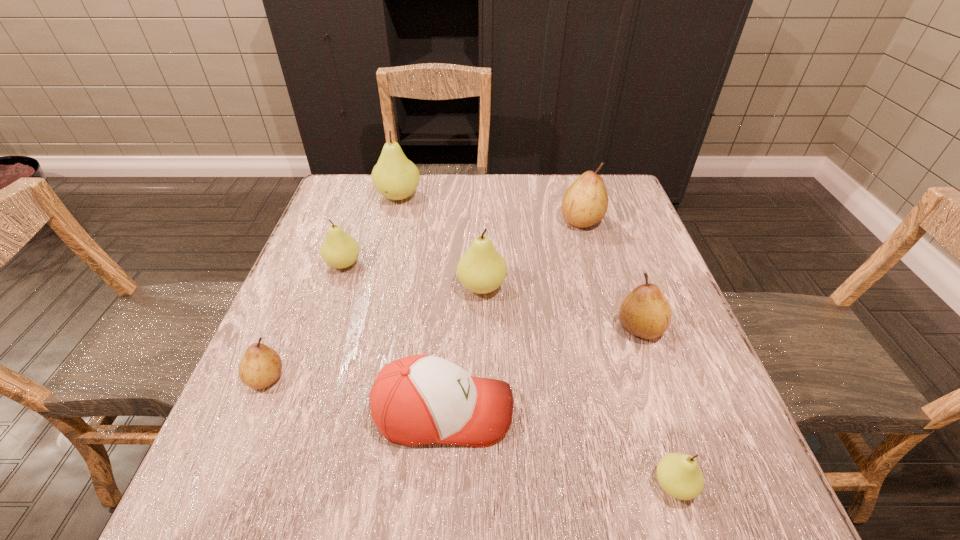
Locate an element on the screen. This screenshot has width=960, height=540. the tallest object is located at coordinates (395, 177).

Where is `the farthest green pear`? The height and width of the screenshot is (540, 960). the farthest green pear is located at coordinates (395, 177).

Image resolution: width=960 pixels, height=540 pixels. Identify the location of the biggest brown pear. (585, 203).

Image resolution: width=960 pixels, height=540 pixels. What are the coordinates of `the third green pear from left to right` in the screenshot? It's located at (482, 269).

This screenshot has width=960, height=540. I want to click on the fourth pear from right to left, so click(x=482, y=269).

At what (x,y) coordinates should I click in order to perform the action: click on the third biggest green pear. Please return your answer as a coordinate pair (x, y). Looking at the image, I should click on (339, 250).

Locate an element on the screen. This screenshot has height=540, width=960. the second nearest brown pear is located at coordinates (645, 312).

Locate an element on the screen. the second biggest brown pear is located at coordinates (645, 312).

At what (x,y) coordinates should I click in order to perform the action: click on orange baseball cap. Please return your answer as a coordinate pair (x, y). Image resolution: width=960 pixels, height=540 pixels. Looking at the image, I should click on (421, 399).

The height and width of the screenshot is (540, 960). I want to click on the smallest brown pear, so click(x=261, y=366).